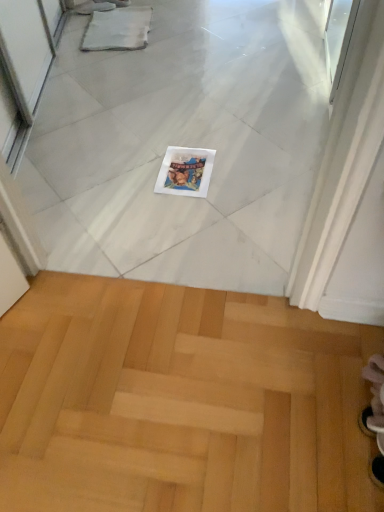
Question: In terms of height, does white glossy magazine at center look taller or shorter compared to light wood parquet floor at lower center?

Choices:
 (A) short
 (B) tall

Answer: (A)

Question: In terms of size, does white glossy magazine at center appear bigger or smaller than light wood parquet floor at lower center?

Choices:
 (A) small
 (B) big

Answer: (A)

Question: Considering their positions, is white glossy magazine at center located in front of or behind light wood parquet floor at lower center?

Choices:
 (A) front
 (B) behind

Answer: (B)

Question: Is light wood parquet floor at lower center inside or outside of white glossy magazine at center?

Choices:
 (A) outside
 (B) inside

Answer: (A)

Question: Is point (163, 443) positioned closer to the camera than point (173, 148)?

Choices:
 (A) closer
 (B) farther

Answer: (A)

Question: Based on their positions, is light wood parquet floor at lower center located to the left or right of white glossy magazine at center?

Choices:
 (A) right
 (B) left

Answer: (B)

Question: Considering the positions of light wood parquet floor at lower center and white glossy magazine at center in the image, is light wood parquet floor at lower center taller or shorter than white glossy magazine at center?

Choices:
 (A) short
 (B) tall

Answer: (B)